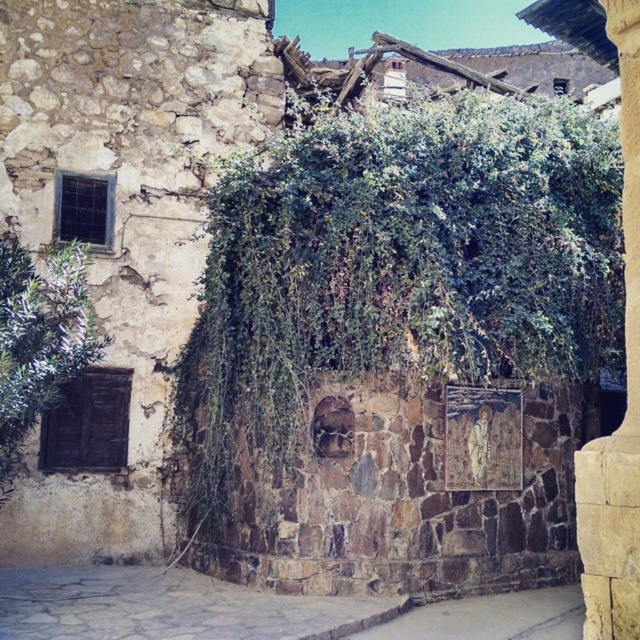
Does green leafy ivy at center have a greater width compared to gray stone alley at lower center?

Incorrect, green leafy ivy at center's width does not surpass gray stone alley at lower center's.

You are a GUI agent. You are given a task and a screenshot of the screen. Output one action in this format:
    pyautogui.click(x=<x>, y=<y>)
    Task: Click on the green leafy ivy at center
    The image size is (640, 640).
    Given the screenshot: What is the action you would take?
    point(397,268)

Is point (484, 376) closer to viewer compared to point (636, 236)?

No.

Who is lower down, green leafy ivy at center or smooth stone pillar at right?

Positioned lower is green leafy ivy at center.

Who is more distant from viewer, (x=608, y=266) or (x=621, y=115)?

Point (x=608, y=266)

At what (x,y) coordinates should I click in order to perform the action: click on green leafy ivy at center. Please return your answer as a coordinate pair (x, y). Looking at the image, I should click on (397, 268).

Does gray stone alley at lower center have a lesser width compared to smooth stone pillar at right?

No.

The height and width of the screenshot is (640, 640). In order to click on gray stone alley at lower center in this screenshot , I will do `click(259, 611)`.

The height and width of the screenshot is (640, 640). Identify the location of gray stone alley at lower center. (259, 611).

At what (x,y) coordinates should I click in order to perform the action: click on gray stone alley at lower center. Please return your answer as a coordinate pair (x, y). This screenshot has width=640, height=640. Looking at the image, I should click on (259, 611).